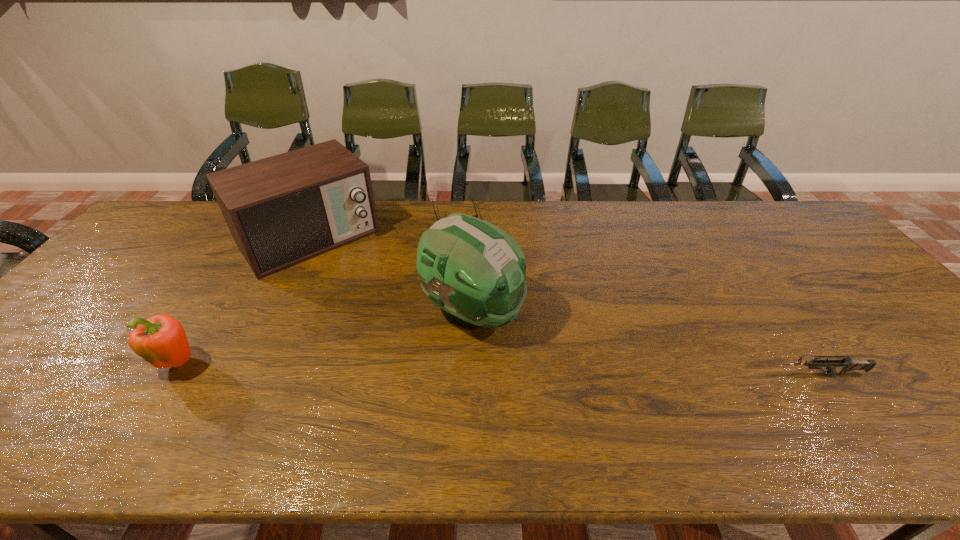
Where is `the third tallest object`? The width and height of the screenshot is (960, 540). the third tallest object is located at coordinates (161, 340).

Locate an element on the screen. This screenshot has width=960, height=540. gun is located at coordinates (848, 365).

The width and height of the screenshot is (960, 540). What are the coordinates of `the second shortest object` in the screenshot? It's located at (848, 365).

At what (x,y) coordinates should I click in order to perform the action: click on football helmet. Please return your answer as a coordinate pair (x, y). Looking at the image, I should click on (474, 271).

Image resolution: width=960 pixels, height=540 pixels. I want to click on sunglasses, so click(x=476, y=215).

The height and width of the screenshot is (540, 960). Find the location of `the second tallest object`. the second tallest object is located at coordinates (281, 210).

Locate an element on the screen. vacant area situated on the back of the pepper is located at coordinates pos(247,258).

Where is `free spot located 0.220m aimed along the barrel of the rightmost object`? This screenshot has height=540, width=960. free spot located 0.220m aimed along the barrel of the rightmost object is located at coordinates (683, 374).

Image resolution: width=960 pixels, height=540 pixels. What are the coordinates of `free space located aimed along the barrel of the rightmost object` in the screenshot? It's located at (708, 374).

Find the location of `vacant space located 0.380m aimed along the barrel of the rightmost object`. vacant space located 0.380m aimed along the barrel of the rightmost object is located at coordinates 612,374.